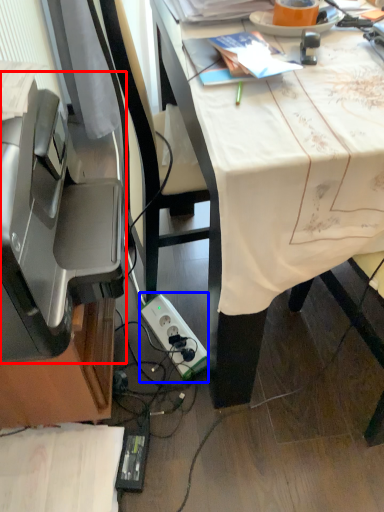
Question: Which object is closer to the camera taking this photo, printer (highlighted by a red box) or power plugs and sockets (highlighted by a blue box)?

Choices:
 (A) printer
 (B) power plugs and sockets

Answer: (A)